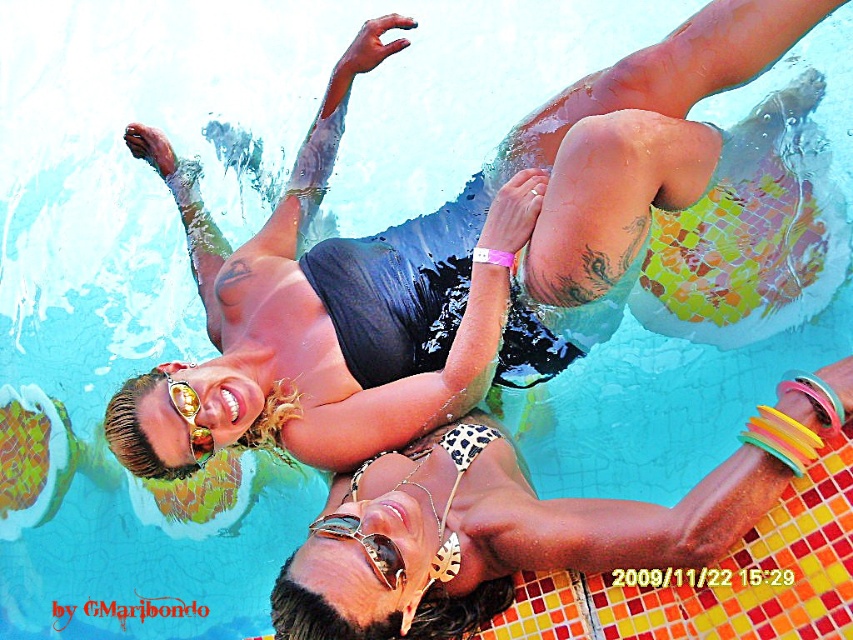
Question: Which point is closer to the camera taking this photo?

Choices:
 (A) (422, 513)
 (B) (189, 440)
 (C) (355, 531)

Answer: (C)

Question: Is gold metallic goggles at center below gold reflective sunglasses at upper center?

Choices:
 (A) yes
 (B) no

Answer: (A)

Question: Does gold metallic goggles at center appear on the left side of gold reflective sunglasses at upper center?

Choices:
 (A) yes
 (B) no

Answer: (B)

Question: Which object is the farthest from the leopard print bikini top at upper center?

Choices:
 (A) gold reflective sunglasses at upper center
 (B) gold metallic goggles at center

Answer: (A)

Question: Is gold metallic goggles at center smaller than gold reflective sunglasses at upper center?

Choices:
 (A) yes
 (B) no

Answer: (B)

Question: Among these points, which one is farthest from the camera?

Choices:
 (A) (390, 548)
 (B) (532, 518)

Answer: (B)